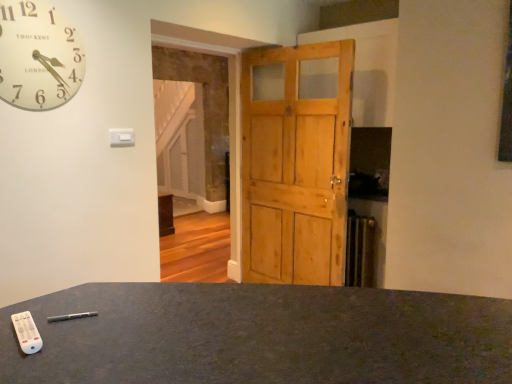
Identify the location of white wooden clock at upper left. (38, 56).

Where is `white plastic remote at lower left`? white plastic remote at lower left is located at coordinates (27, 332).

From the image's perspective, is white plastic remote at lower left above or below white wooden clock at upper left?

white plastic remote at lower left is below white wooden clock at upper left.

Is point (29, 348) positioned before point (49, 37)?

That is True.

Between white plastic remote at lower left and white wooden clock at upper left, which one has smaller size?

white plastic remote at lower left is smaller.

From a real-world perspective, which is physically below, natural wood barn door at center or white wooden clock at upper left?

natural wood barn door at center.

Considering the positions of objects natural wood barn door at center and white wooden clock at upper left in the image provided, who is in front, natural wood barn door at center or white wooden clock at upper left?

Positioned in front is white wooden clock at upper left.

Does natural wood barn door at center appear on the left side of white wooden clock at upper left?

No.

Considering the positions of point (288, 255) and point (83, 54), is point (288, 255) closer or farther from the camera than point (83, 54)?

Point (288, 255).

Is matte black desk at lower center at the back of white wooden clock at upper left?

No, white wooden clock at upper left is not facing the opposite direction of matte black desk at lower center.

Which is more to the left, white wooden clock at upper left or matte black desk at lower center?

Positioned to the left is white wooden clock at upper left.

Can you tell me how much white wooden clock at upper left and matte black desk at lower center differ in facing direction?

0.555 degrees separate the facing orientations of white wooden clock at upper left and matte black desk at lower center.

From a real-world perspective, between matte black desk at lower center and white plastic remote at lower left, who is vertically lower?

matte black desk at lower center is physically lower.

Does point (283, 366) appear closer or farther from the camera than point (21, 348)?

Point (283, 366) appears to be closer to the viewer than point (21, 348).

Which object is thinner, matte black desk at lower center or white plastic remote at lower left?

With smaller width is white plastic remote at lower left.

Is matte black desk at lower center outside of white plastic remote at lower left?

Indeed, matte black desk at lower center is completely outside white plastic remote at lower left.

Are natural wood barn door at center and white plastic remote at lower left beside each other?

natural wood barn door at center and white plastic remote at lower left are clearly separated.

Is the depth of natural wood barn door at center greater than that of white plastic remote at lower left?

Yes, the depth of natural wood barn door at center is greater than that of white plastic remote at lower left.

Is natural wood barn door at center surrounding white plastic remote at lower left?

No, natural wood barn door at center does not contain white plastic remote at lower left.

Is natural wood barn door at center to the left of white plastic remote at lower left from the viewer's perspective?

No, natural wood barn door at center is not to the left of white plastic remote at lower left.

The image size is (512, 384). What are the coordinates of `desk below the natural wood barn door at center (from the image's perspective)` in the screenshot? It's located at (261, 336).

Does matte black desk at lower center turn towards natural wood barn door at center?

No, matte black desk at lower center is not aimed at natural wood barn door at center.

Are matte black desk at lower center and natural wood barn door at center making contact?

matte black desk at lower center and natural wood barn door at center are clearly separated.

Considering the sizes of objects matte black desk at lower center and natural wood barn door at center in the image provided, who is wider, matte black desk at lower center or natural wood barn door at center?

Wider between the two is matte black desk at lower center.

Can you confirm if natural wood barn door at center is shorter than matte black desk at lower center?

No.

Considering the relative sizes of natural wood barn door at center and matte black desk at lower center in the image provided, is natural wood barn door at center thinner than matte black desk at lower center?

Yes, natural wood barn door at center is thinner than matte black desk at lower center.

From a real-world perspective, who is located higher, natural wood barn door at center or matte black desk at lower center?

From a 3D spatial view, natural wood barn door at center is above.

Find the location of a particular element. This screenshot has width=512, height=384. wall clock behind the white plastic remote at lower left is located at coordinates (38, 56).

I want to click on barn door on the right of white wooden clock at upper left, so click(x=296, y=163).

Considering their positions, is natural wood barn door at center positioned closer to matte black desk at lower center than white plastic remote at lower left?

white plastic remote at lower left is closer to matte black desk at lower center.

In the scene shown: Considering their positions, is white plastic remote at lower left positioned closer to matte black desk at lower center than white wooden clock at upper left?

white plastic remote at lower left is closer to matte black desk at lower center.

Considering their positions, is matte black desk at lower center positioned closer to white wooden clock at upper left than natural wood barn door at center?

matte black desk at lower center is closer to white wooden clock at upper left.

Considering their positions, is white wooden clock at upper left positioned closer to natural wood barn door at center than white plastic remote at lower left?

Based on the image, white wooden clock at upper left appears to be nearer to natural wood barn door at center.

Estimate the real-world distances between objects in this image. Which object is further from matte black desk at lower center, white wooden clock at upper left or white plastic remote at lower left?

white wooden clock at upper left.

Looking at the image, which one is located closer to white plastic remote at lower left, natural wood barn door at center or white wooden clock at upper left?

Based on the image, white wooden clock at upper left appears to be nearer to white plastic remote at lower left.

Based on the photo, which object lies nearer to the anchor point white wooden clock at upper left, white plastic remote at lower left or natural wood barn door at center?

white plastic remote at lower left.

Looking at the image, which one is located closer to matte black desk at lower center, white plastic remote at lower left or natural wood barn door at center?

The object closer to matte black desk at lower center is white plastic remote at lower left.

Locate an element on the screen. control between white wooden clock at upper left and matte black desk at lower center from top to bottom is located at coordinates (27, 332).

This screenshot has width=512, height=384. Identify the location of control positioned between matte black desk at lower center and natural wood barn door at center from near to far. (27, 332).

Locate an element on the screen. This screenshot has height=384, width=512. wall clock positioned between white plastic remote at lower left and natural wood barn door at center from near to far is located at coordinates (38, 56).

At what (x,y) coordinates should I click in order to perform the action: click on wall clock positioned between matte black desk at lower center and natural wood barn door at center from near to far. Please return your answer as a coordinate pair (x, y). The image size is (512, 384). Looking at the image, I should click on (38, 56).